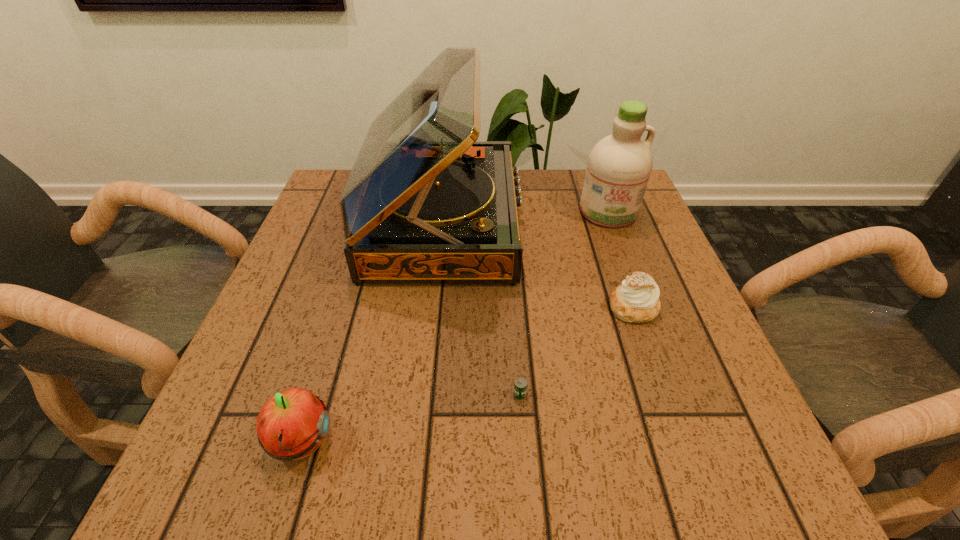
I want to click on free space located on the right of the shortest object, so click(707, 394).

The height and width of the screenshot is (540, 960). Find the location of `record player positioned at the far edge`. record player positioned at the far edge is located at coordinates (425, 202).

Locate an element on the screen. The image size is (960, 540). cleansing agent positioned at the far edge is located at coordinates (619, 166).

This screenshot has width=960, height=540. Find the location of `object present at the near edge`. object present at the near edge is located at coordinates (291, 425).

Where is `record player located in the left edge section of the desktop`? The width and height of the screenshot is (960, 540). record player located in the left edge section of the desktop is located at coordinates (425, 202).

This screenshot has width=960, height=540. Find the location of `apple present at the left edge`. apple present at the left edge is located at coordinates (291, 425).

Image resolution: width=960 pixels, height=540 pixels. I want to click on cleansing agent located in the right edge section of the desktop, so click(x=619, y=166).

Find the location of `pastry that is at the right edge`. pastry that is at the right edge is located at coordinates (636, 300).

Identify the location of object that is at the far left corner. The width and height of the screenshot is (960, 540). (425, 202).

At what (x,y) coordinates should I click in order to perform the action: click on object that is at the near left corner. Please return your answer as a coordinate pair (x, y). Looking at the image, I should click on (291, 425).